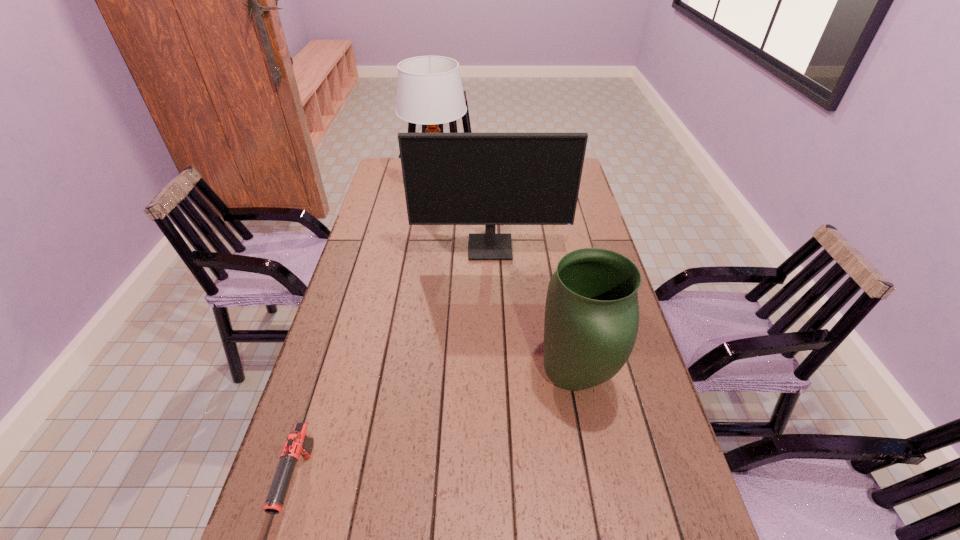
I want to click on table lamp that is positioned at the left edge, so click(429, 90).

Locate an element on the screen. This screenshot has width=960, height=540. gun located at the left edge is located at coordinates (298, 443).

The width and height of the screenshot is (960, 540). Identify the location of computer monitor that is positioned at the right edge. pos(490,179).

Identify the location of vase at the right edge. This screenshot has height=540, width=960. [591, 322].

I want to click on object at the far left corner, so click(429, 90).

At what (x,y) coordinates should I click in order to perform the action: click on vacant area at the left edge of the desktop. Please return your answer as a coordinate pair (x, y). The width and height of the screenshot is (960, 540). Looking at the image, I should click on (388, 191).

The height and width of the screenshot is (540, 960). Identify the location of vacant area at the right edge. (642, 455).

At what (x,y) coordinates should I click in order to perform the action: click on vacant space at the far left corner. Please return your answer as a coordinate pair (x, y). The width and height of the screenshot is (960, 540). Looking at the image, I should click on (391, 160).

I want to click on vacant space that is in between the farthest object and the leftmost object, so click(x=369, y=334).

This screenshot has height=540, width=960. I want to click on blank region between the third farthest object and the nearest object, so click(x=437, y=430).